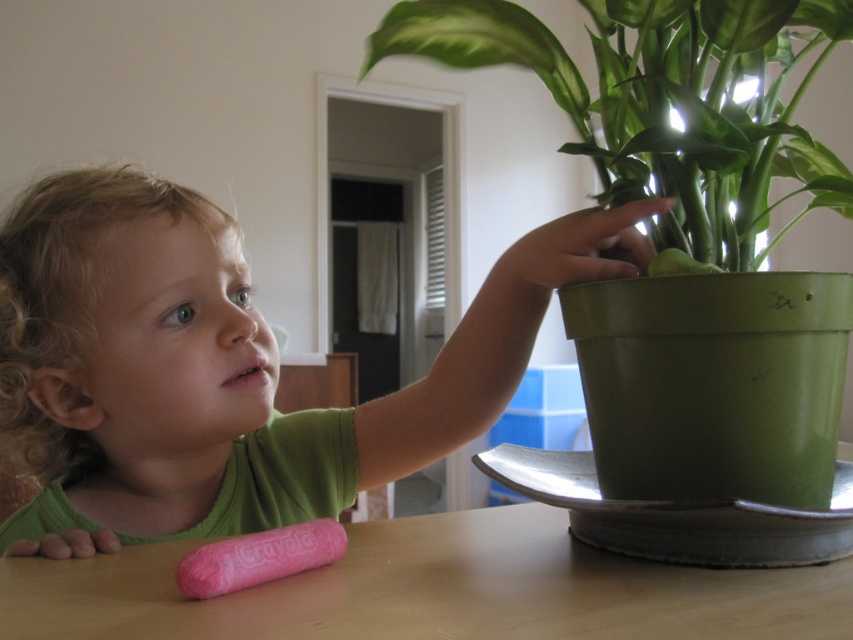
A child is reaching towards a plant. The child is at point (706, 225). If the child can reach 20 inches, can they touch the plant?

The distance between the child and the plant is 20.85 inches, which is slightly more than the child can reach. The child cannot touch the plant.